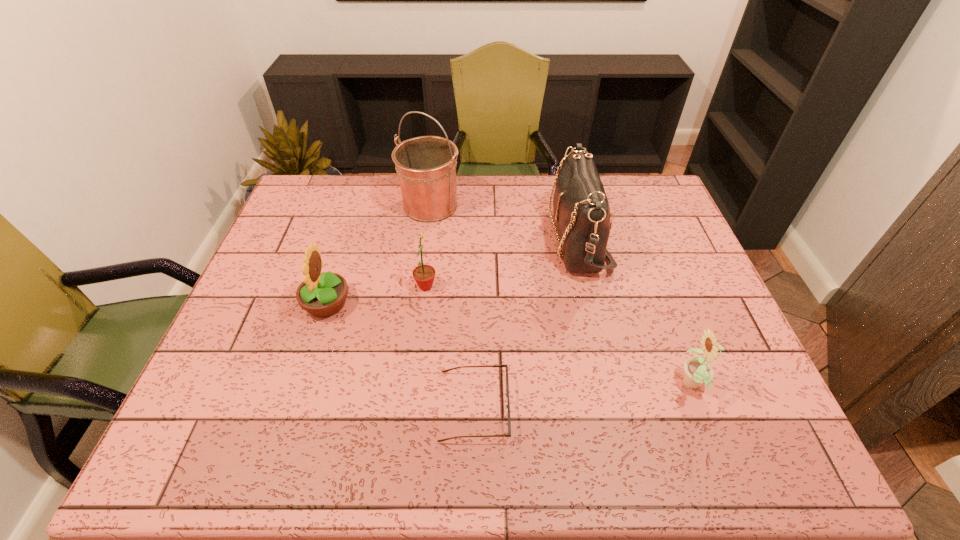
Identify the location of free location located 0.070m at the front of the second tallest object with chain and zipper. Image resolution: width=960 pixels, height=540 pixels. (527, 238).

Where is `vacant region located at the front of the second tallest object with chain and zipper`? The width and height of the screenshot is (960, 540). vacant region located at the front of the second tallest object with chain and zipper is located at coordinates (456, 238).

Where is `vacant space located on the face of the leftmost sunflower`? vacant space located on the face of the leftmost sunflower is located at coordinates (403, 304).

You are a GUI agent. You are given a task and a screenshot of the screen. Output one action in this format:
    pyautogui.click(x=<x>, y=<y>)
    Task: Click on the free space located 0.280m on the face of the second sunflower from left to right
    The image size is (960, 540).
    Given the screenshot: What is the action you would take?
    pyautogui.click(x=538, y=286)

At what (x,y) coordinates should I click in order to perform the action: click on vacant space located on the front-facing side of the rightmost object. Please return your answer as a coordinate pair (x, y). The width and height of the screenshot is (960, 540). Looking at the image, I should click on (543, 385).

What are the coordinates of `vacant space positioned on the front-facing side of the rightmost object` in the screenshot? It's located at (600, 385).

Where is `vacant space located 0.330m on the front-facing side of the rightmost object`? vacant space located 0.330m on the front-facing side of the rightmost object is located at coordinates click(531, 385).

The width and height of the screenshot is (960, 540). What are the coordinates of `free region located on the front-facing side of the shortest object` in the screenshot? It's located at (536, 406).

I want to click on bucket at the far edge, so click(x=426, y=166).

The width and height of the screenshot is (960, 540). In order to click on handbag that is at the far edge in this screenshot , I will do `click(581, 208)`.